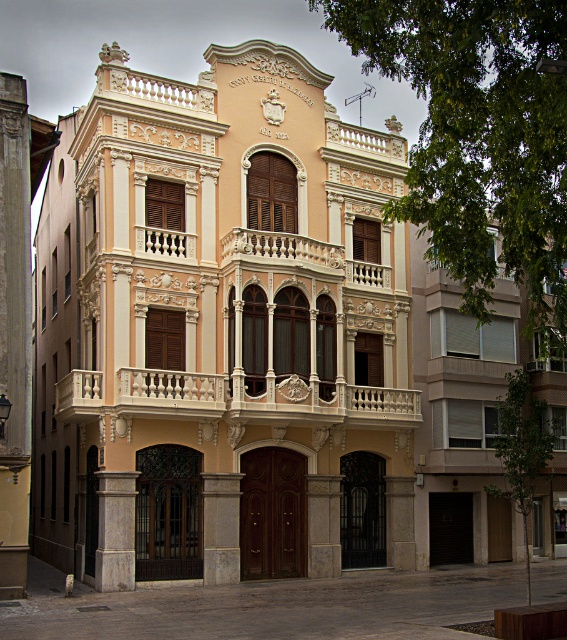
Question: Is white marble balcony at center bigger than white stone column at lower left?

Choices:
 (A) no
 (B) yes

Answer: (B)

Question: Which point is closer to the camera?

Choices:
 (A) white stone column at lower left
 (B) gray stone pillar at center
 (C) smooth stone pillar at center
 (D) white marble balcony at center

Answer: (A)

Question: Can you confirm if white marble balcony at center is positioned to the left of gray stone pillar at center?

Choices:
 (A) no
 (B) yes

Answer: (B)

Question: Does white stone column at lower left come behind smooth stone pillar at center?

Choices:
 (A) no
 (B) yes

Answer: (A)

Question: Which point appears closest to the camera in this image?

Choices:
 (A) (115, 572)
 (B) (378, 424)

Answer: (A)

Question: Which point is closer to the camera taking this photo?

Choices:
 (A) (147, 401)
 (B) (214, 509)

Answer: (A)